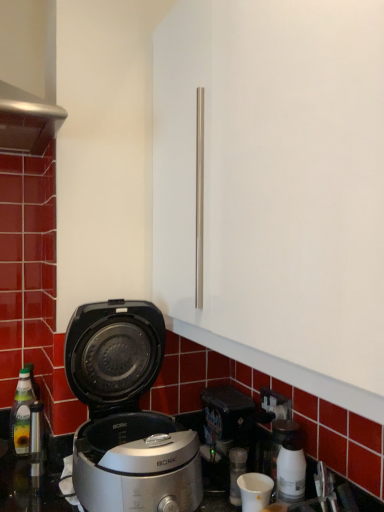
Question: Is white matte cup at lower center oriented away from white glossy coffee machine at lower right?

Choices:
 (A) no
 (B) yes

Answer: (B)

Question: From the image's perspective, would you say white matte cup at lower center is positioned over white glossy coffee machine at lower right?

Choices:
 (A) no
 (B) yes

Answer: (A)

Question: Is white matte cup at lower center positioned before white glossy coffee machine at lower right?

Choices:
 (A) yes
 (B) no

Answer: (A)

Question: Considering the relative sizes of white matte cup at lower center and white glossy coffee machine at lower right in the image provided, is white matte cup at lower center thinner than white glossy coffee machine at lower right?

Choices:
 (A) no
 (B) yes

Answer: (A)

Question: Is white matte cup at lower center at the left side of white glossy coffee machine at lower right?

Choices:
 (A) no
 (B) yes

Answer: (B)

Question: Is white matte cup at lower center shorter than white glossy coffee machine at lower right?

Choices:
 (A) yes
 (B) no

Answer: (A)

Question: Considering the relative sizes of white matte cup at lower center and black plastic electric outlet at lower right in the image provided, is white matte cup at lower center thinner than black plastic electric outlet at lower right?

Choices:
 (A) no
 (B) yes

Answer: (A)

Question: Is white matte cup at lower center bigger than black plastic electric outlet at lower right?

Choices:
 (A) yes
 (B) no

Answer: (A)

Question: Can you confirm if white matte cup at lower center is positioned to the right of black plastic electric outlet at lower right?

Choices:
 (A) no
 (B) yes

Answer: (A)

Question: Is white matte cup at lower center touching black plastic electric outlet at lower right?

Choices:
 (A) no
 (B) yes

Answer: (A)

Question: From a real-world perspective, is white matte cup at lower center beneath black plastic electric outlet at lower right?

Choices:
 (A) yes
 (B) no

Answer: (A)

Question: Would you say black plastic electric outlet at lower right is part of white matte cup at lower center's contents?

Choices:
 (A) no
 (B) yes

Answer: (A)

Question: Is translucent glass bottle at left aimed at white glossy coffee machine at lower right?

Choices:
 (A) no
 (B) yes

Answer: (A)